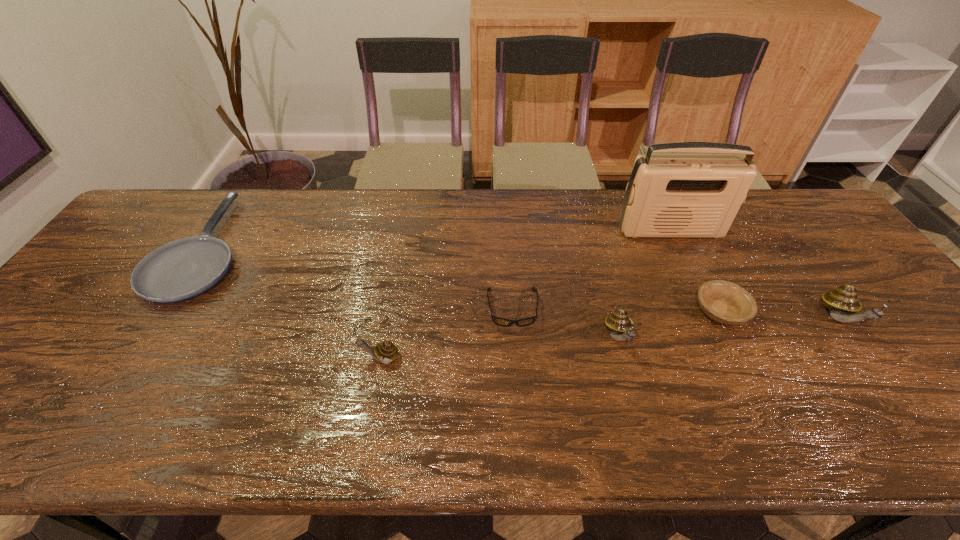
Choose which object is the fourth nearest neighbor to the third tallest object. Please provide its 2D coordinates. Your answer should be formatted as a tuple, i.e. [(x, y)], where the tuple contains the x and y coordinates of a point satisfying the conditions above.

[(385, 352)]

Select which snail appears as the second closest to the leftmost object. Please provide its 2D coordinates. Your answer should be formatted as a tuple, i.e. [(x, y)], where the tuple contains the x and y coordinates of a point satisfying the conditions above.

[(618, 322)]

Identify the location of snail identified as the second closest to the fifth object from right to left. (385, 352).

Find the location of a particular element. The height and width of the screenshot is (540, 960). free spot that satisfies the following two spatial constraints: 1. on the front-facing side of the spectacles; 2. on the right side of the bowl is located at coordinates (513, 312).

Where is `vacant position in the image that satisfies the following two spatial constraints: 1. on the front side of the bowl; 2. on the face of the leftmost snail`? This screenshot has height=540, width=960. vacant position in the image that satisfies the following two spatial constraints: 1. on the front side of the bowl; 2. on the face of the leftmost snail is located at coordinates (743, 358).

At what (x,y) coordinates should I click in order to perform the action: click on free space that satisfies the following two spatial constraints: 1. on the face of the fifth shortest object; 2. on the face of the shortest snail. Please return your answer as a coordinate pair (x, y). The width and height of the screenshot is (960, 540). Looking at the image, I should click on (624, 358).